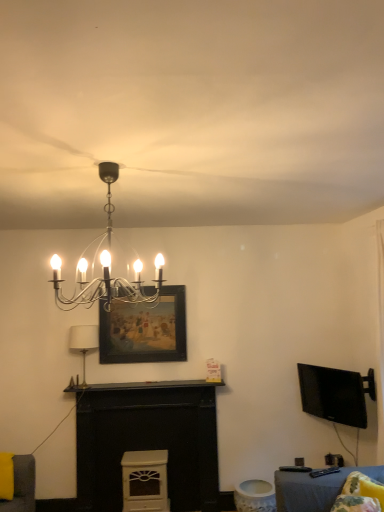
The width and height of the screenshot is (384, 512). What are the coordinates of `free space above polished chrome chandelier at upper center, placed as the 2th lamp when sorted from back to front (from a real-world perspective)` in the screenshot? It's located at (113, 160).